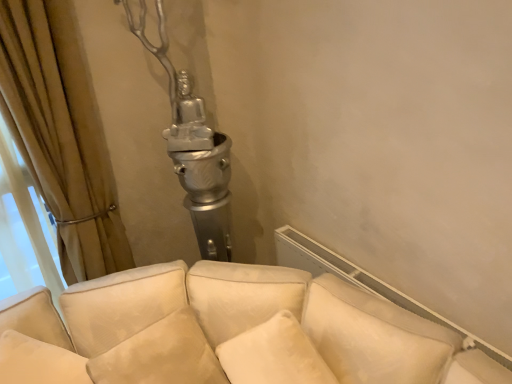
Identify the location of suede-like beige pillow at center. (161, 355).

Image resolution: width=512 pixels, height=384 pixels. Describe the element at coordinates (161, 355) in the screenshot. I see `suede-like beige pillow at center` at that location.

Image resolution: width=512 pixels, height=384 pixels. I want to click on suede-like beige pillow at center, so click(161, 355).